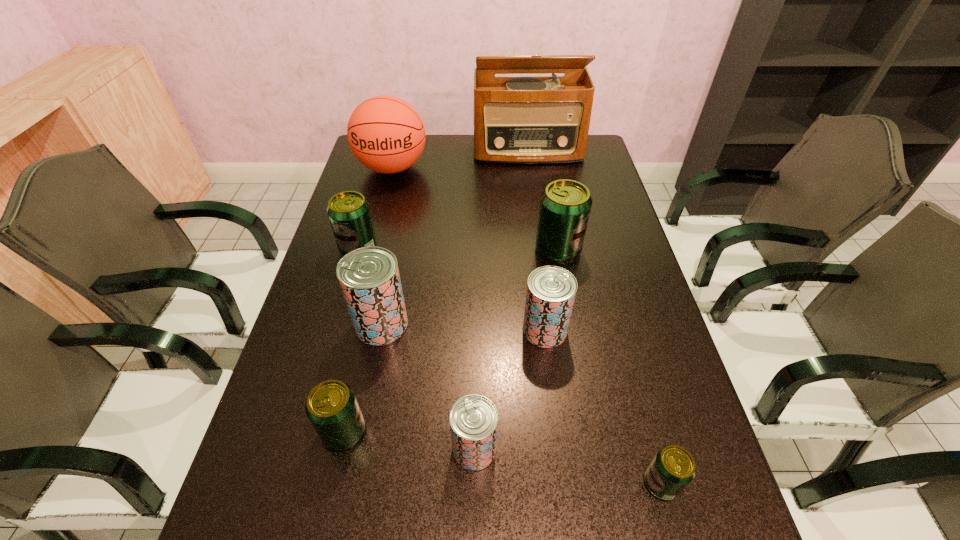
Find the location of a particular element. This screenshot has width=960, height=540. the tallest object is located at coordinates (541, 119).

Where is `basketball`? This screenshot has width=960, height=540. basketball is located at coordinates (386, 134).

The image size is (960, 540). I want to click on the second green beer can from right to left, so click(x=565, y=205).

Where is `the leftmost red beer can`? the leftmost red beer can is located at coordinates (369, 278).

Find the location of a particular element. The width and height of the screenshot is (960, 540). the rightmost red beer can is located at coordinates (551, 290).

The image size is (960, 540). I want to click on the second biggest green beer can, so click(349, 213).

The image size is (960, 540). In order to click on the nearest red beer can in this screenshot , I will do `click(473, 419)`.

Find the location of `the fourth beer can from right to left`. the fourth beer can from right to left is located at coordinates (473, 419).

Locate an element on the screen. Image resolution: width=960 pixels, height=540 pixels. the second nearest green beer can is located at coordinates (332, 408).

Where is `the shortest beer can`? The height and width of the screenshot is (540, 960). the shortest beer can is located at coordinates (672, 469).